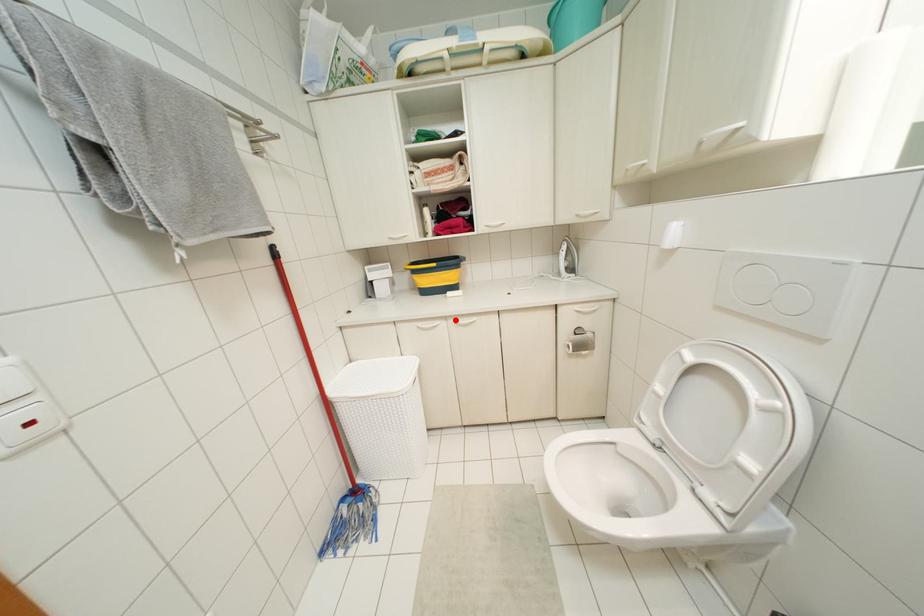
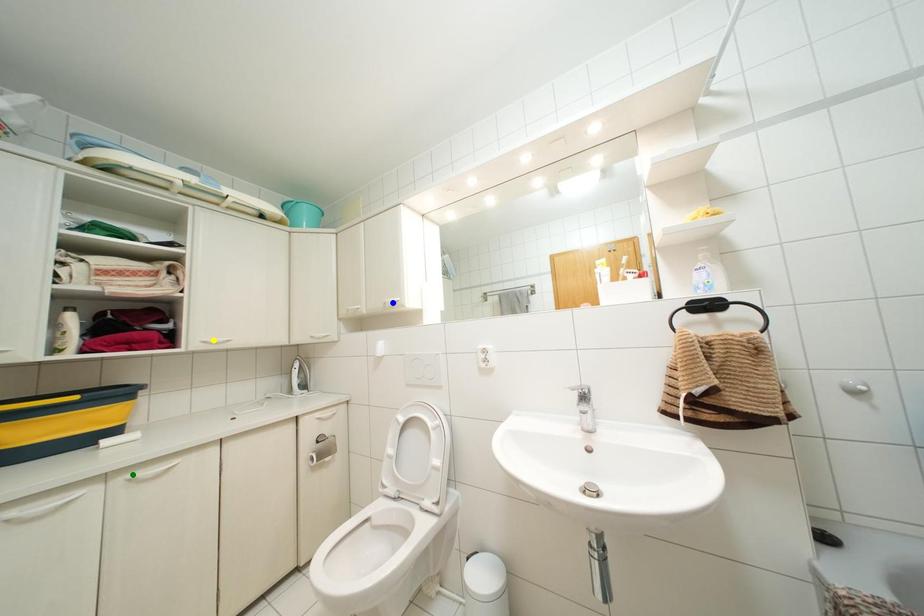
Question: I am providing you with two images of the same scene from different viewpoints. A red point is marked on the first image. You are given multiple points on the second image. Can you choose the point in image 2 that corresponds to the point in image 1?

Choices:
 (A) yellow point
 (B) green point
 (C) blue point

Answer: (B)